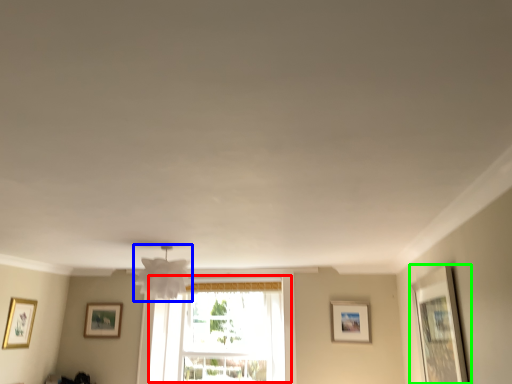
Question: Which object is the closest to the window (highlighted by a red box)? Choose among these: lamp (highlighted by a blue box) or picture frame (highlighted by a green box).

Choices:
 (A) lamp
 (B) picture frame

Answer: (A)